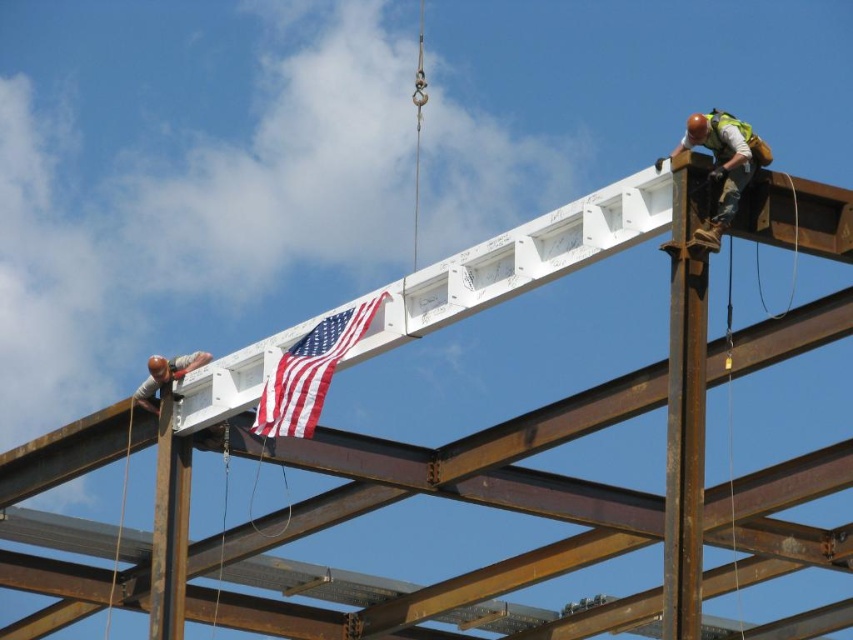
Question: Which of the following is the farthest from the observer?

Choices:
 (A) brushed metal helmet at lower left
 (B) rusty metal pole at upper right
 (C) american flag at center

Answer: (A)

Question: Which object is positioned closest to the brushed metal helmet at lower left?

Choices:
 (A) american flag at center
 (B) smooth brown pole at lower left
 (C) hard hat steel worker at upper right

Answer: (A)

Question: Among these points, which one is nearest to the camera?

Choices:
 (A) (183, 524)
 (B) (740, 188)
 (C) (157, 381)

Answer: (B)

Question: Considering the relative positions of rusty metal pole at upper right and hard hat steel worker at upper right in the image provided, where is rusty metal pole at upper right located with respect to hard hat steel worker at upper right?

Choices:
 (A) right
 (B) left

Answer: (A)

Question: Is the position of rusty metal pole at upper right less distant than that of brushed metal helmet at lower left?

Choices:
 (A) yes
 (B) no

Answer: (A)

Question: Can you confirm if rusty metal pole at upper right is positioned above brushed metal helmet at lower left?

Choices:
 (A) yes
 (B) no

Answer: (B)